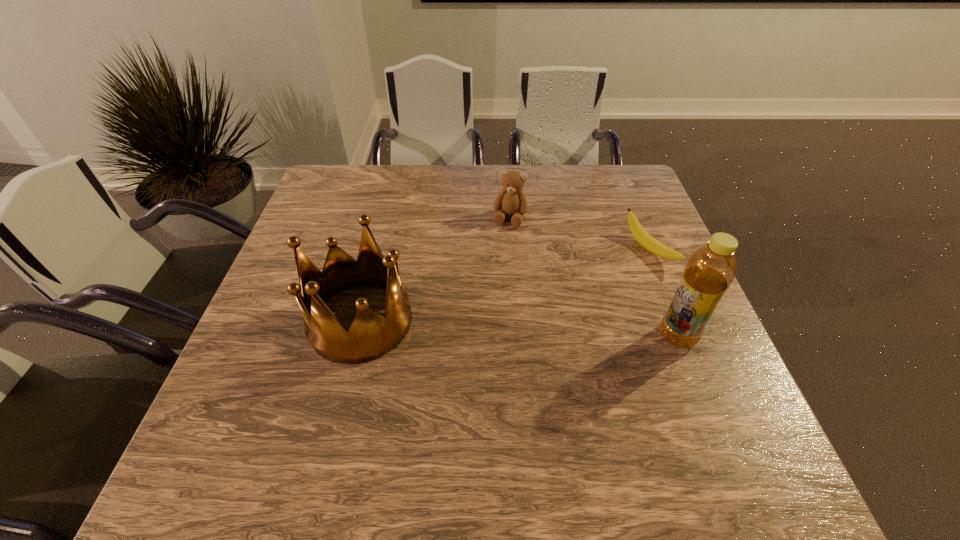
Identify the location of free space located 0.180m on the front-facing side of the teddy bear. (494, 273).

You are a GUI agent. You are given a task and a screenshot of the screen. Output one action in this format:
    pyautogui.click(x=<x>, y=<y>)
    Task: Click on the vacant space situated on the upward curve of the banana
    The image size is (960, 540).
    Given the screenshot: What is the action you would take?
    pyautogui.click(x=529, y=307)

In order to click on vacant region located 0.220m on the upward curve of the banana in this screenshot , I will do `click(567, 291)`.

Where is `free space located 0.360m on the upward curve of the banana`? Image resolution: width=960 pixels, height=540 pixels. free space located 0.360m on the upward curve of the banana is located at coordinates [517, 312].

Find the location of a particular element. This screenshot has height=540, width=960. object present at the far edge is located at coordinates (511, 200).

At what (x,y) coordinates should I click in order to perform the action: click on object that is at the left edge. Please return your answer as a coordinate pair (x, y). Looking at the image, I should click on (371, 335).

You are a GUI agent. You are given a task and a screenshot of the screen. Output one action in this format:
    pyautogui.click(x=<x>, y=<y>)
    Task: Click on the bottle located at the right edge
    The width and height of the screenshot is (960, 540).
    Given the screenshot: What is the action you would take?
    pyautogui.click(x=710, y=270)

Image resolution: width=960 pixels, height=540 pixels. In order to click on banana situated at the right edge in this screenshot , I will do `click(642, 237)`.

Find the location of a particular element. vacant region at the far edge is located at coordinates (392, 166).

Find the location of `free location at the near edge`. free location at the near edge is located at coordinates (454, 397).